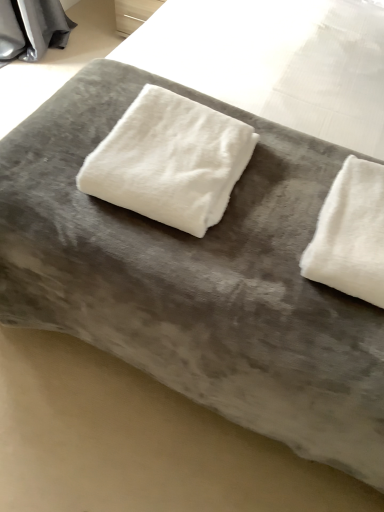
Find the location of `free space in front of white fluffy towel at center, placed as the first towel when sorted from left to right`. free space in front of white fluffy towel at center, placed as the first towel when sorted from left to right is located at coordinates (189, 258).